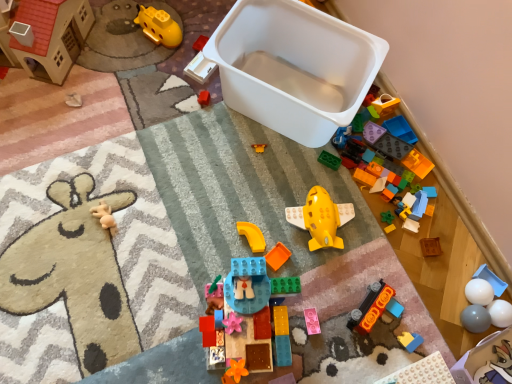
Locate an element on the screen. The width and height of the screenshot is (512, 384). free space that is in between yellow matte airplane at center, the 8th toy from the left, and translucent blue plastic building block at center, the 12th toy from the right is located at coordinates (290, 274).